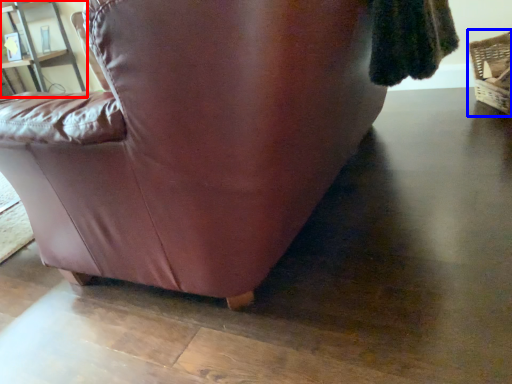
Question: Which object appears closest to the camera in this image, shelf (highlighted by a red box) or basket (highlighted by a blue box)?

Choices:
 (A) shelf
 (B) basket

Answer: (B)